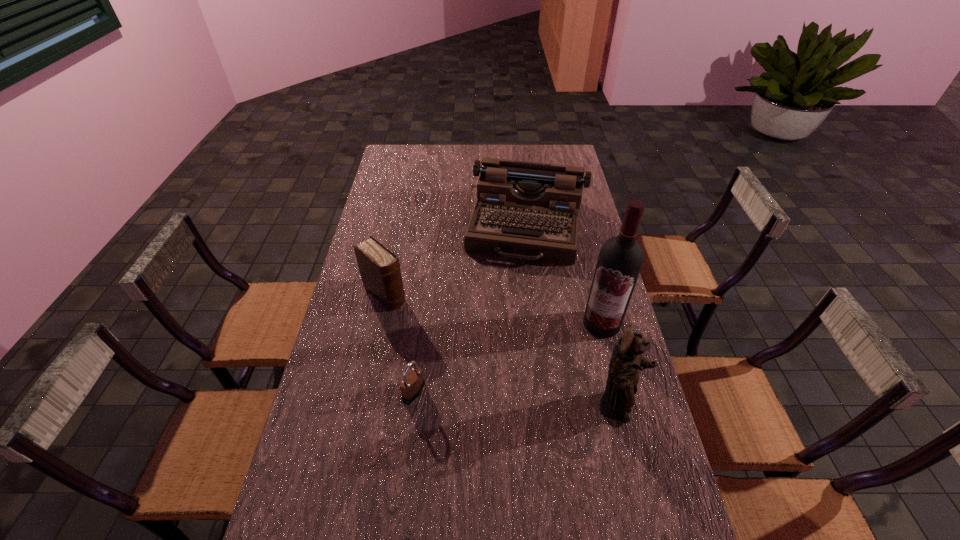
The image size is (960, 540). What are the coordinates of `wine bottle at the right edge` in the screenshot? It's located at (620, 260).

Locate an element on the screen. Image resolution: width=960 pixels, height=540 pixels. vacant space at the far edge of the desktop is located at coordinates (437, 145).

At what (x,y) coordinates should I click in order to perform the action: click on free space at the near edge of the desktop. Please return your answer as a coordinate pair (x, y). Looking at the image, I should click on (430, 507).

Identify the location of vacant region at the left edge of the desktop. The image size is (960, 540). (315, 444).

In the image, there is a desktop. Where is `vacant space at the right edge`? vacant space at the right edge is located at coordinates (612, 444).

Locate an element on the screen. The image size is (960, 540). vacant space at the far left corner of the desktop is located at coordinates (410, 159).

The height and width of the screenshot is (540, 960). I want to click on vacant space at the near left corner, so click(x=350, y=498).

The height and width of the screenshot is (540, 960). Identify the location of vacant space at the far right corner of the desktop. (553, 148).

I want to click on vacant area that lies between the leftmost object and the figurine, so click(501, 352).

The width and height of the screenshot is (960, 540). Identify the location of vacant space that's between the farthest object and the tallest object. click(564, 275).